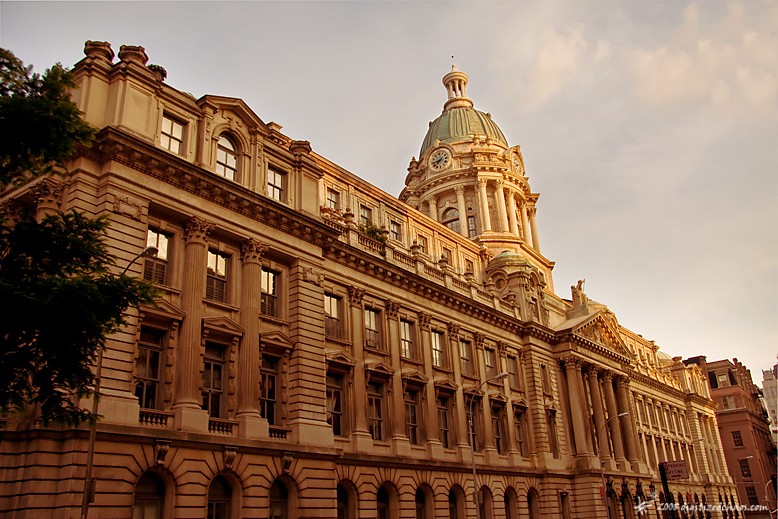
Locate an element on the screen. This screenshot has height=519, width=778. architectural pedestal is located at coordinates (601, 335).